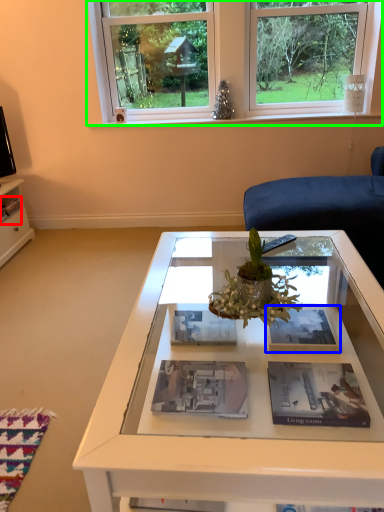
Question: Considering the real-world distances, which object is closest to magazine (highlighted by a red box)? magazine (highlighted by a blue box) or window (highlighted by a green box).

Choices:
 (A) magazine
 (B) window

Answer: (B)